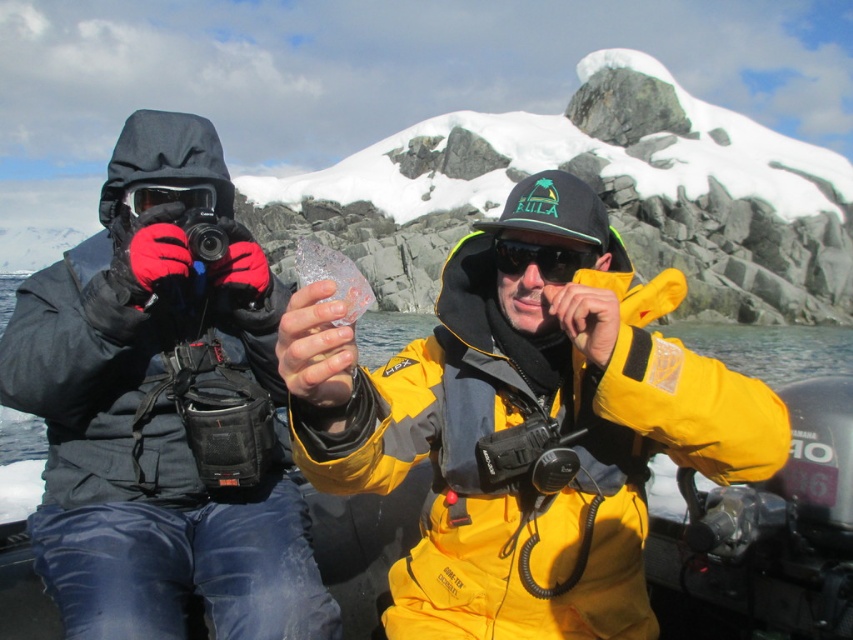
The image size is (853, 640). What do you see at coordinates (541, 259) in the screenshot? I see `black matte sunglasses at center` at bounding box center [541, 259].

Is black matte sunglasses at center to the right of matte black goggles at left from the viewer's perspective?

Yes, black matte sunglasses at center is to the right of matte black goggles at left.

Does point (546, 252) lie behind point (201, 188)?

No, it is in front of (201, 188).

Find the location of `black matte sunglasses at center`. black matte sunglasses at center is located at coordinates (541, 259).

Is matte black jacket at left to the right of black matte sunglasses at center from the viewer's perspective?

No, matte black jacket at left is not to the right of black matte sunglasses at center.

Between point (167, 552) and point (511, 243), which one is positioned behind?

Point (511, 243)

Which is in front, point (123, 413) or point (560, 280)?

Point (560, 280)

Where is `matte black jacket at left`? The image size is (853, 640). matte black jacket at left is located at coordinates (163, 417).

Is matte black jacket at left smaller than matte black goggles at left?

No, matte black jacket at left is not smaller than matte black goggles at left.

Who is higher up, matte black jacket at left or matte black goggles at left?

matte black goggles at left is above.

Between point (16, 369) and point (167, 186), which one is positioned in front?

Point (16, 369) is more forward.

Where is `matte black jacket at left`? matte black jacket at left is located at coordinates (163, 417).